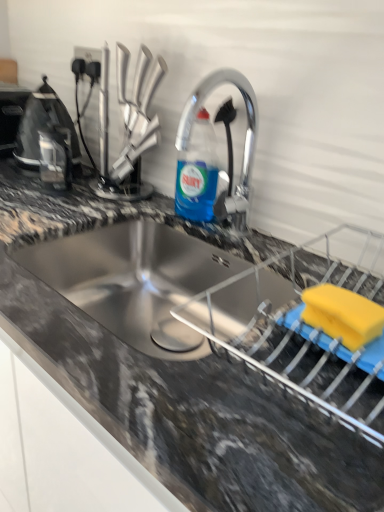
Locate an element on the screen. blank space to the left of metallic silver faucet at upper center is located at coordinates tap(142, 201).